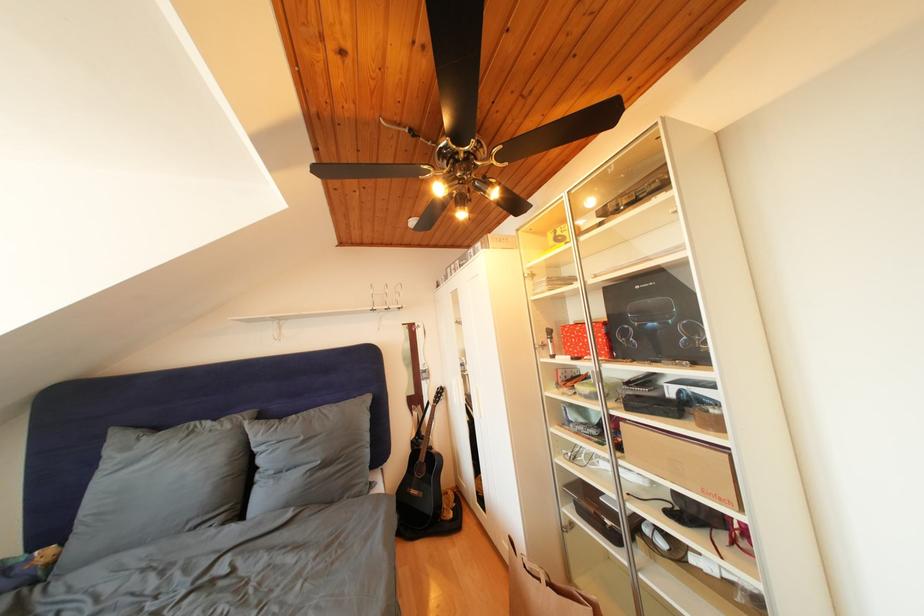
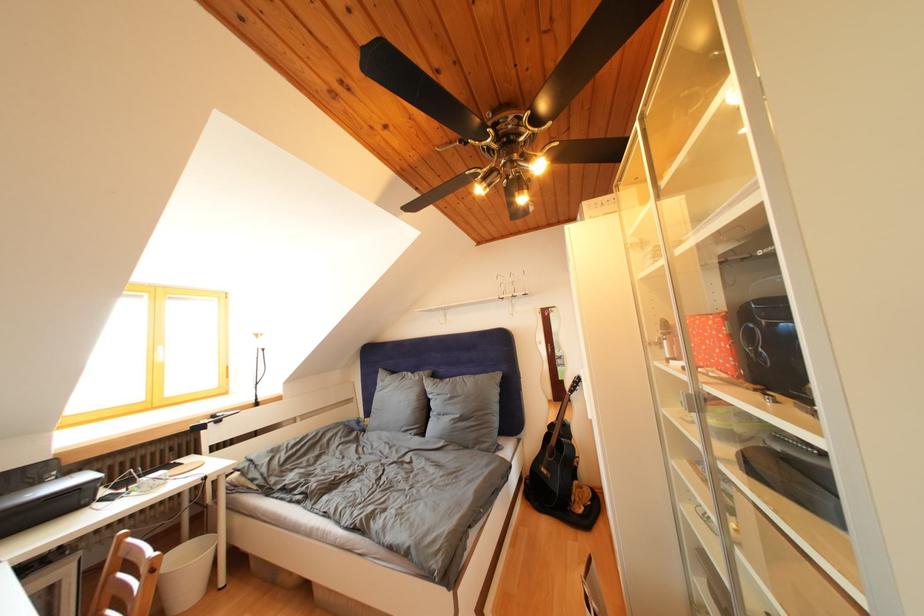
The point at [236,432] is marked in the first image. Where is the corresponding point in the second image?

(426, 383)